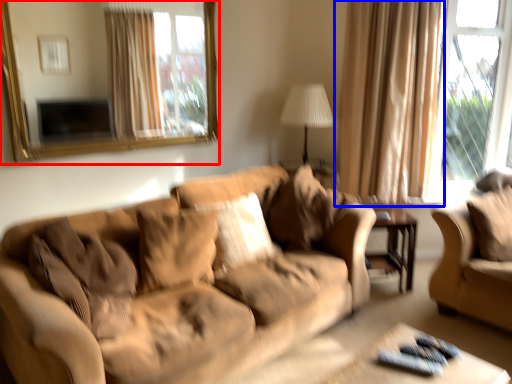
Question: Which point is further to the camera, mirror (highlighted by a red box) or curtain (highlighted by a blue box)?

Choices:
 (A) mirror
 (B) curtain

Answer: (B)